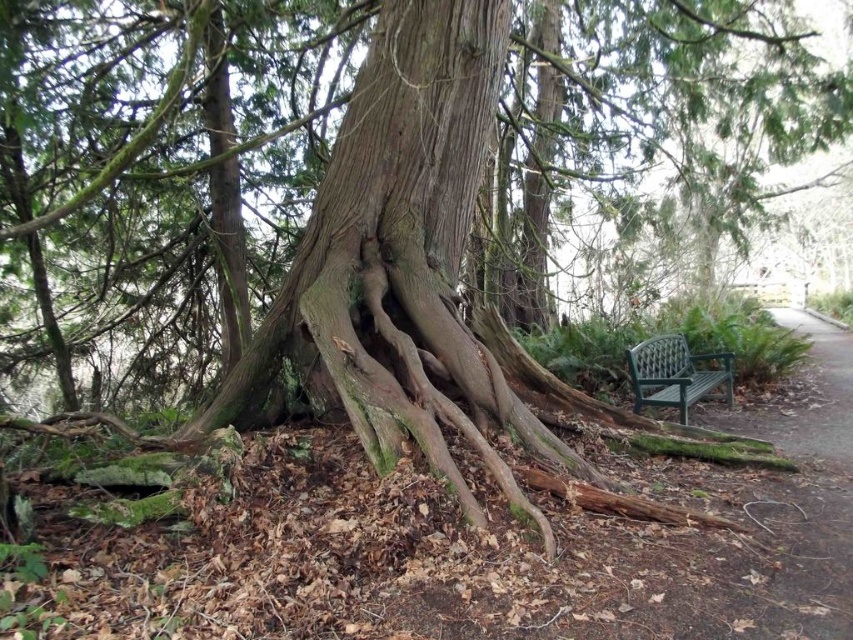
Question: Does smooth brown bark at center appear on the right side of green plastic bench at right?

Choices:
 (A) yes
 (B) no

Answer: (B)

Question: Among these points, which one is farthest from the camera?

Choices:
 (A) pyautogui.click(x=270, y=314)
 (B) pyautogui.click(x=653, y=376)

Answer: (B)

Question: Can you confirm if smooth brown bark at center is smaller than green plastic bench at right?

Choices:
 (A) no
 (B) yes

Answer: (A)

Question: Which point appears closest to the camera in this image?

Choices:
 (A) (645, 348)
 (B) (369, 86)

Answer: (B)

Question: Is smooth brown bark at center smaller than green plastic bench at right?

Choices:
 (A) no
 (B) yes

Answer: (A)